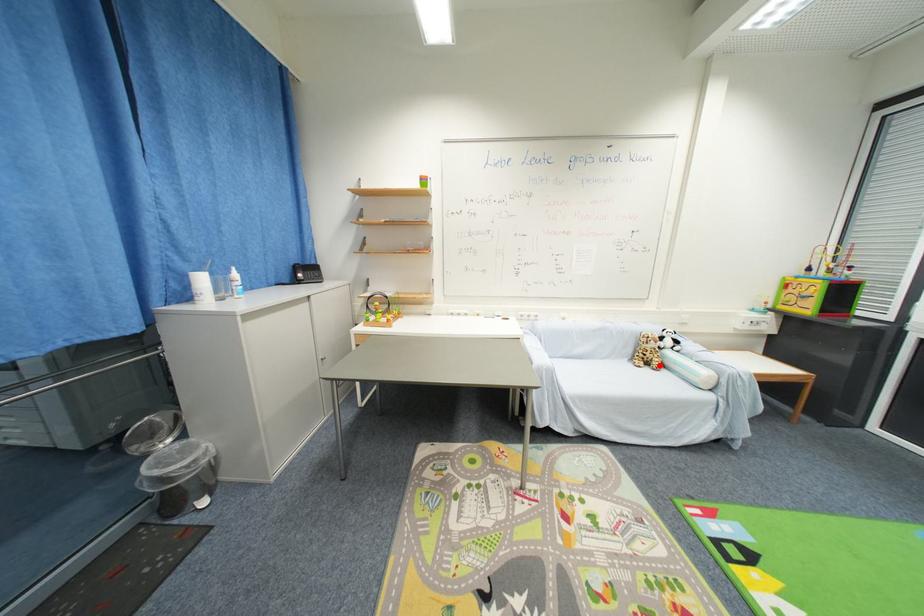
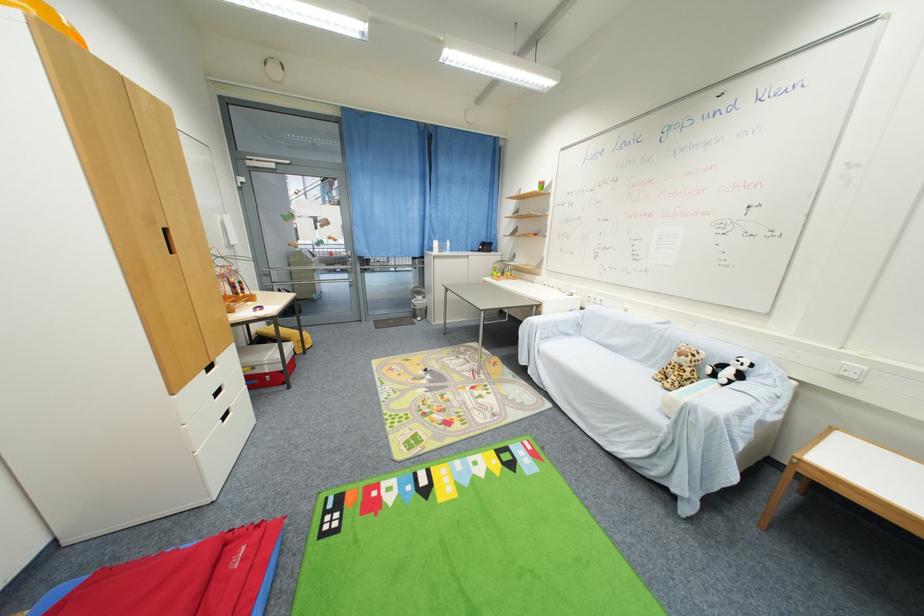
In the second image, find the point that corresponds to the highlighted location in the first image.

(675, 382)